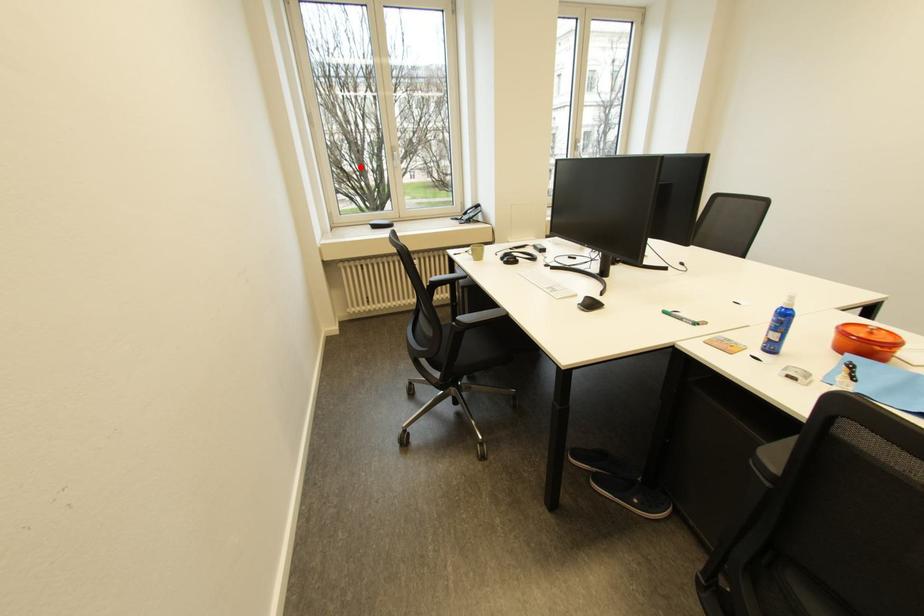
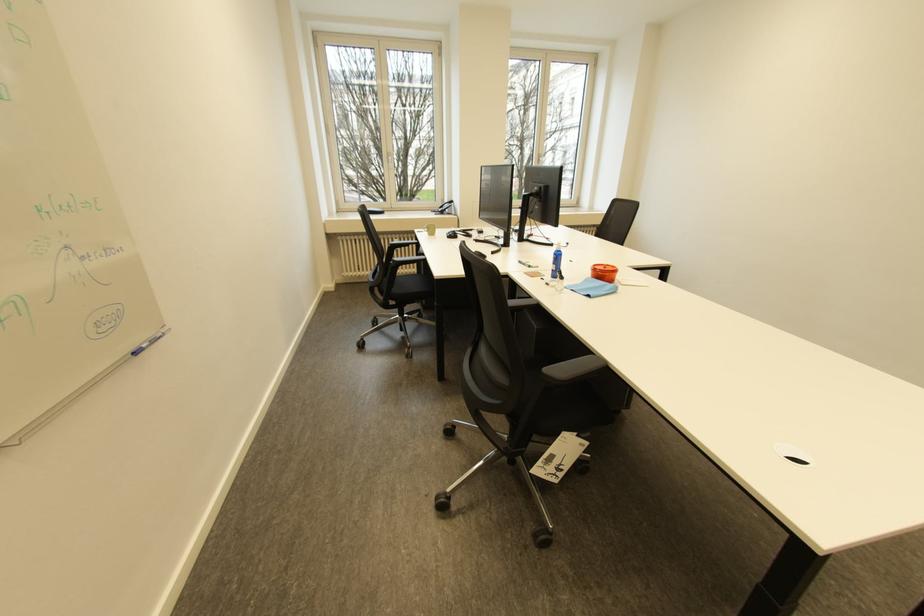
The point at the highlighted location is marked in the first image. Where is the corresponding point in the second image?

(386, 171)